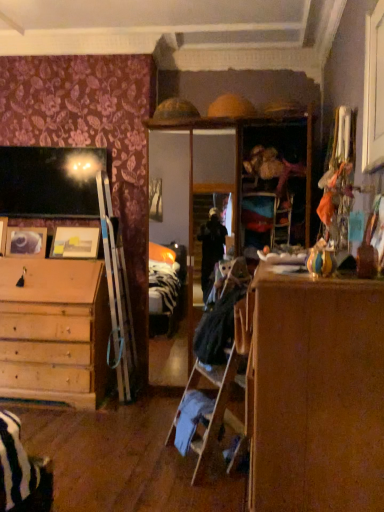
Question: Is black fabric laundry at center far away from matte wooden picture frame at left, which appears as the 1th picture frame when viewed from the right?

Choices:
 (A) no
 (B) yes

Answer: (B)

Question: Can you confirm if black fabric laundry at center is bigger than matte wooden picture frame at left, which appears as the 1th picture frame when viewed from the right?

Choices:
 (A) yes
 (B) no

Answer: (A)

Question: From a real-world perspective, is black fabric laundry at center physically below matte wooden picture frame at left, which appears as the 1th picture frame when viewed from the right?

Choices:
 (A) no
 (B) yes

Answer: (B)

Question: Is black fabric laundry at center not inside matte wooden picture frame at left, which appears as the 1th picture frame when viewed from the right?

Choices:
 (A) yes
 (B) no

Answer: (A)

Question: From a real-world perspective, is black fabric laundry at center physically above matte wooden picture frame at left, the 2th picture frame when ordered from left to right?

Choices:
 (A) no
 (B) yes

Answer: (A)

Question: Is black fabric laundry at center shorter than matte wooden picture frame at left, the 2th picture frame when ordered from left to right?

Choices:
 (A) no
 (B) yes

Answer: (A)

Question: Is the surface of wooden photo frame at left, marked as the second picture frame in a right-to-left arrangement, in direct contact with black fabric laundry at center?

Choices:
 (A) yes
 (B) no

Answer: (B)

Question: Would you say wooden photo frame at left, marked as the second picture frame in a right-to-left arrangement, is outside black fabric laundry at center?

Choices:
 (A) no
 (B) yes

Answer: (B)

Question: From a real-world perspective, is wooden photo frame at left, marked as the second picture frame in a right-to-left arrangement, beneath black fabric laundry at center?

Choices:
 (A) no
 (B) yes

Answer: (A)

Question: Is black fabric laundry at center at the back of wooden photo frame at left, which appears as the 1th picture frame when viewed from the left?

Choices:
 (A) yes
 (B) no

Answer: (B)

Question: Can you confirm if wooden photo frame at left, which appears as the 1th picture frame when viewed from the left, is bigger than black fabric laundry at center?

Choices:
 (A) no
 (B) yes

Answer: (A)

Question: Is black fabric laundry at center completely or partially inside wooden photo frame at left, marked as the second picture frame in a right-to-left arrangement?

Choices:
 (A) yes
 (B) no

Answer: (B)

Question: Is black fabric laundry at center behind wooden photo frame at left, which appears as the 1th picture frame when viewed from the left?

Choices:
 (A) no
 (B) yes

Answer: (A)